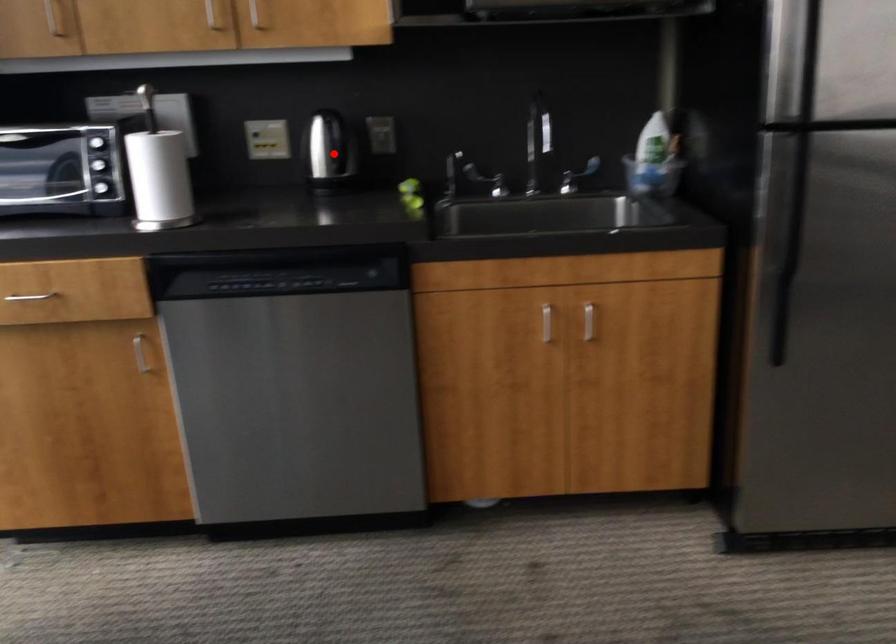
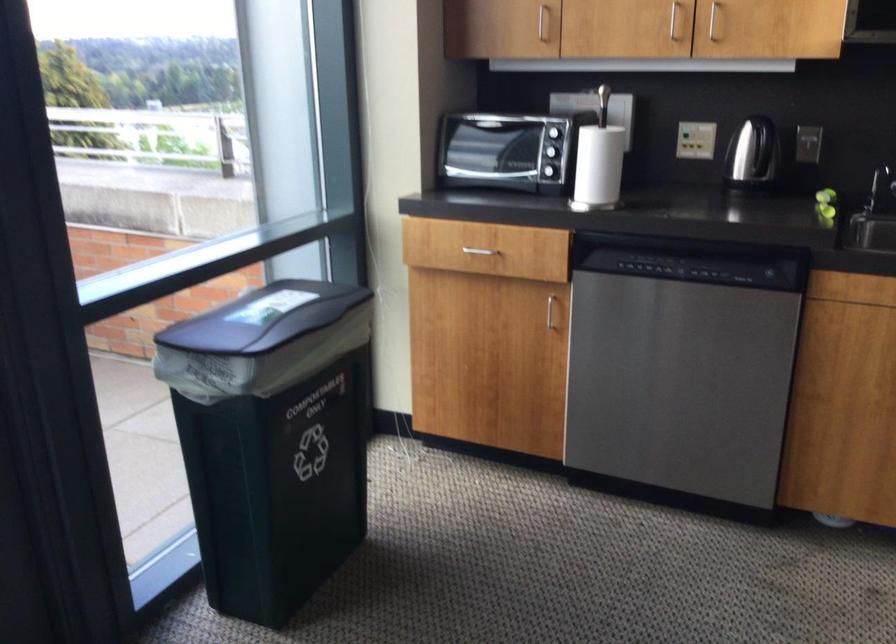
Where in the second image is the point corresponding to the highlighted location from the first image?

(752, 152)